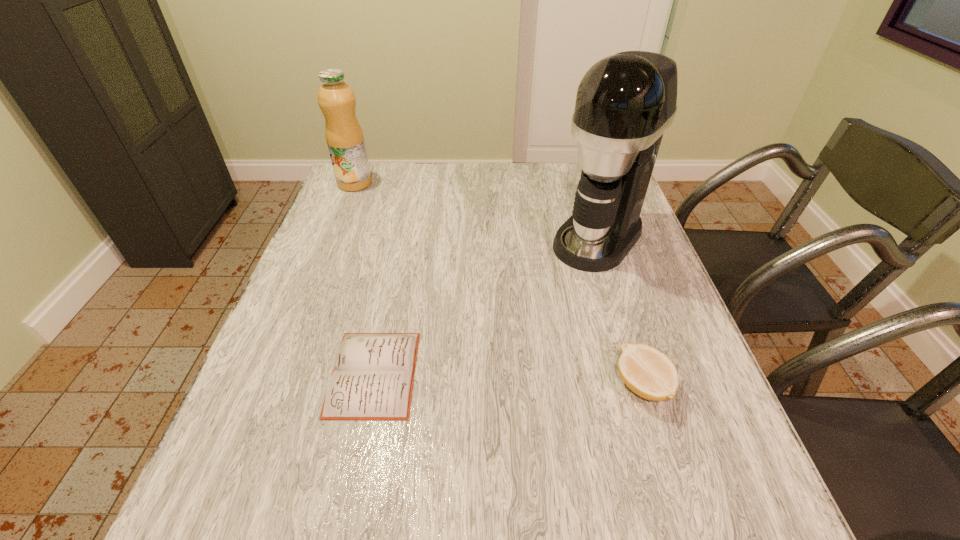
You are a GUI agent. You are given a task and a screenshot of the screen. Output one action in this format:
    pyautogui.click(x=<x>, y=<y>)
    Task: Click on the shortest object
    This screenshot has height=540, width=960.
    Given the screenshot: What is the action you would take?
    pyautogui.click(x=373, y=375)

Locate an element on the screen. The image size is (960, 540). the second object from left to right is located at coordinates (373, 375).

Where is `lemon`? lemon is located at coordinates (649, 373).

At what (x,y) coordinates should I click in order to perform the action: click on the third nearest object. Please return your answer as a coordinate pair (x, y). Image resolution: width=960 pixels, height=540 pixels. Looking at the image, I should click on (625, 102).

The width and height of the screenshot is (960, 540). What are the coordinates of `the tallest object` in the screenshot? It's located at (625, 102).

You are a GUI agent. You are given a task and a screenshot of the screen. Output one action in this format:
    pyautogui.click(x=<x>, y=<y>)
    Task: Click on the leftmost object
    
    Given the screenshot: What is the action you would take?
    pyautogui.click(x=344, y=136)

Locate an element on the screen. fruit juice is located at coordinates (344, 136).

Where is `free region located on the right of the diary`? free region located on the right of the diary is located at coordinates (554, 373).

Where is `free space located 0.300m on the back of the third tallest object`? free space located 0.300m on the back of the third tallest object is located at coordinates (604, 265).

At what (x,y) coordinates should I click in order to perform the action: click on vacant region located place cup under the spout of the second farthest object. Please return your answer as a coordinate pair (x, y). Image resolution: width=960 pixels, height=540 pixels. Looking at the image, I should click on (536, 311).